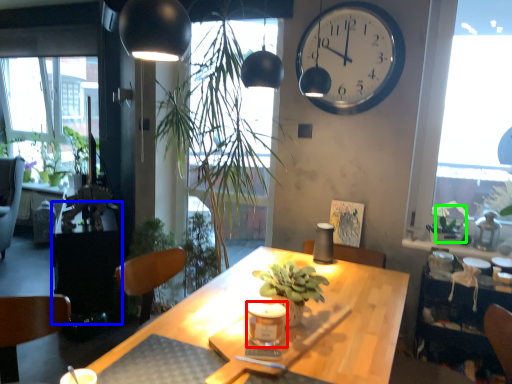
Question: Which is farther away from candle holder (highlighted by a red box)? table (highlighted by a blue box) or plant (highlighted by a green box)?

Choices:
 (A) table
 (B) plant

Answer: (A)